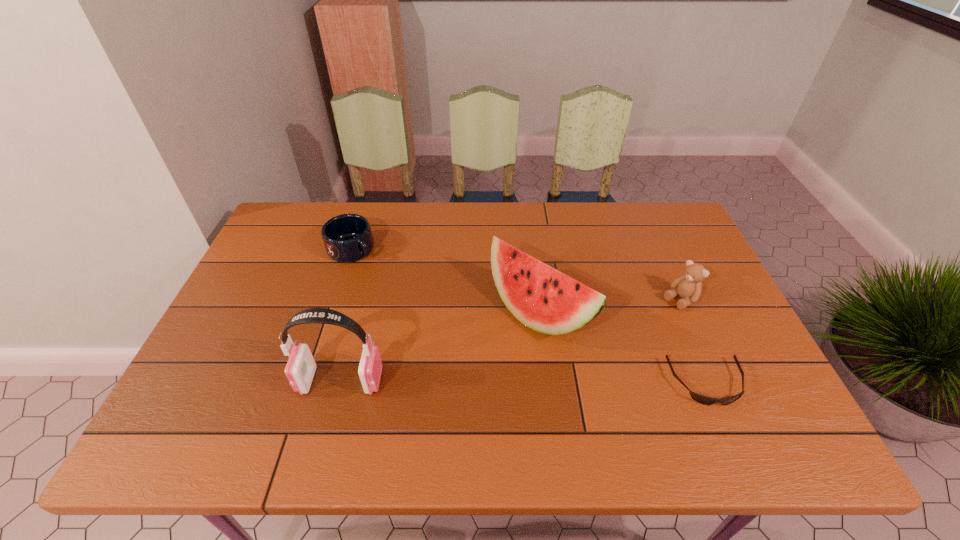
I want to click on earphone, so click(x=300, y=369).

At what (x,y) coordinates should I click in order to perform the action: click on sunglasses. Please return your answer as a coordinate pair (x, y). Looking at the image, I should click on (701, 399).

I want to click on the third tallest object, so click(x=688, y=286).

Locate an element on the screen. Image resolution: width=960 pixels, height=540 pixels. the fourth tallest object is located at coordinates (347, 238).

The image size is (960, 540). Identify the location of the farthest object. (347, 238).

This screenshot has width=960, height=540. I want to click on the fourth shortest object, so click(544, 299).

I want to click on the third object from right to left, so click(544, 299).

Identify the location of free space located on the outer surface of the tallest object. This screenshot has width=960, height=540. (246, 381).

Find the location of `vacant space situated on the outer surface of the tallest object`. vacant space situated on the outer surface of the tallest object is located at coordinates (253, 381).

Where is `blank area located 0.240m on the outer surface of the tallest object`? This screenshot has width=960, height=540. blank area located 0.240m on the outer surface of the tallest object is located at coordinates (199, 381).